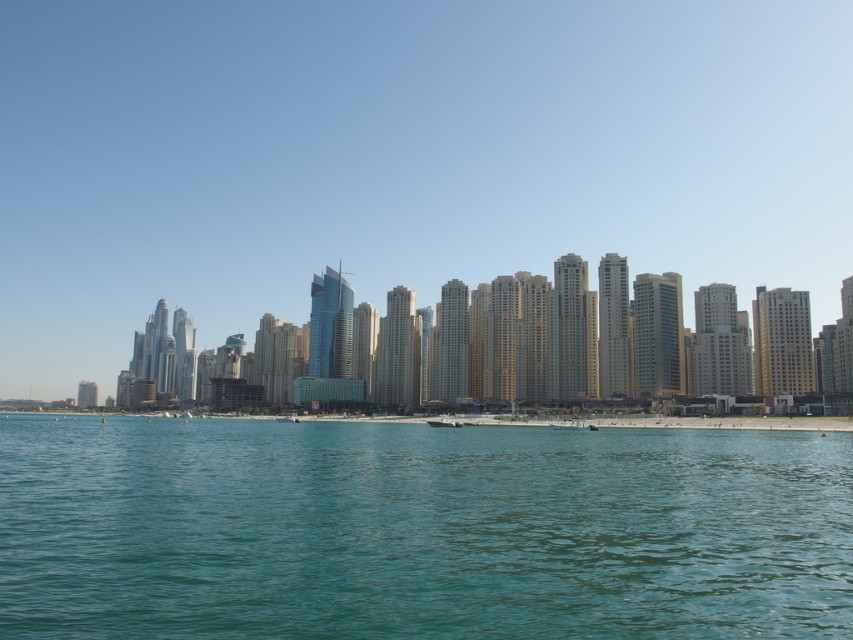
Question: Which object appears farthest from the camera in this image?

Choices:
 (A) white matte boat at lower center
 (B) white glossy boat at center

Answer: (B)

Question: Does white matte boat at lower center come behind white glossy boat at center?

Choices:
 (A) yes
 (B) no

Answer: (B)

Question: Is white matte boat at lower center smaller than white glossy boat at center?

Choices:
 (A) yes
 (B) no

Answer: (A)

Question: Which point is closer to the camera taking this photo?

Choices:
 (A) (386, 460)
 (B) (560, 429)

Answer: (A)

Question: Which object is the closest to the white matte boat at lower center?

Choices:
 (A) white glossy boat at center
 (B) clear blue water at center

Answer: (A)

Question: Does clear blue water at center appear on the right side of white glossy boat at center?

Choices:
 (A) yes
 (B) no

Answer: (B)